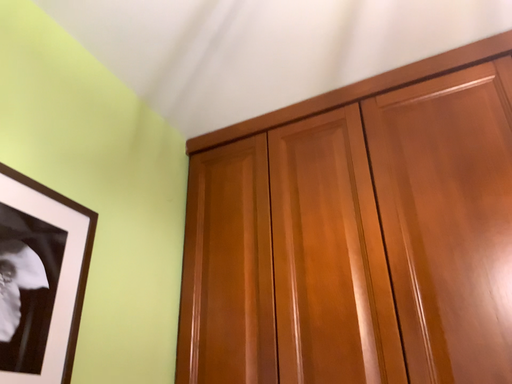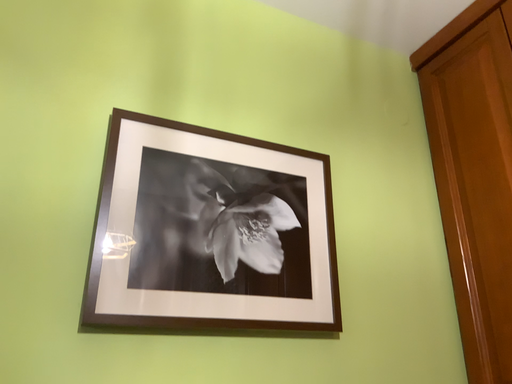
Question: Which way did the camera rotate in the video?

Choices:
 (A) rotated downward
 (B) rotated upward

Answer: (A)